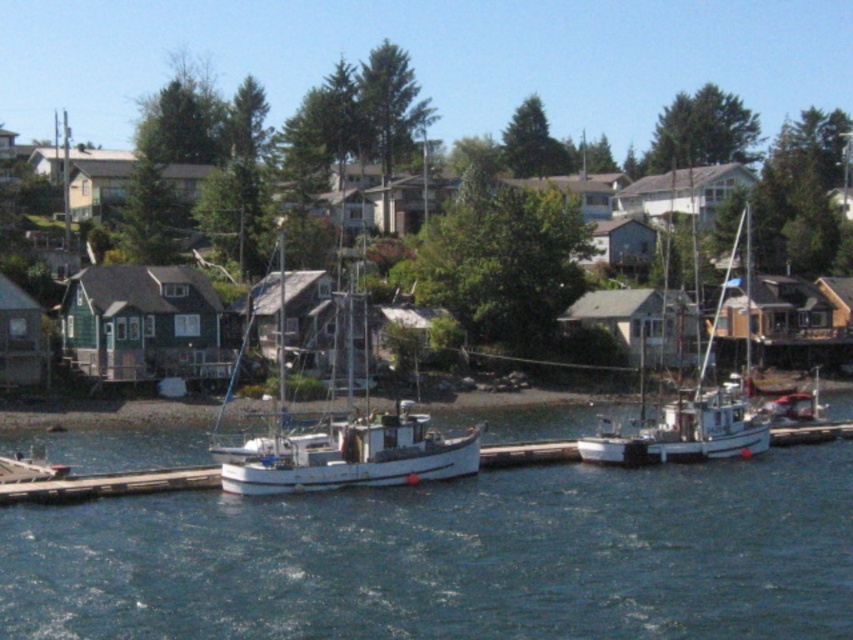
You are a photographer planning to capture the waterfront scene. You want to ensure that both the blue water at center and the white matte boat at center are clearly visible in your shot. Based on their sizes, which object should you focus on first to ensure proper framing?

The white matte boat at center is taller than the blue water at center, so focusing on the boat first will help ensure proper framing for both objects.

You are a photographer planning to capture the reflection of the white matte boat at center in the blue water at center. Based on the scene description, will the reflection be clearly visible?

The blue water at center is positioned under the white matte boat at center, so the reflection of the white matte boat at center in the blue water at center should be clearly visible because calm water typically provides good reflection quality.